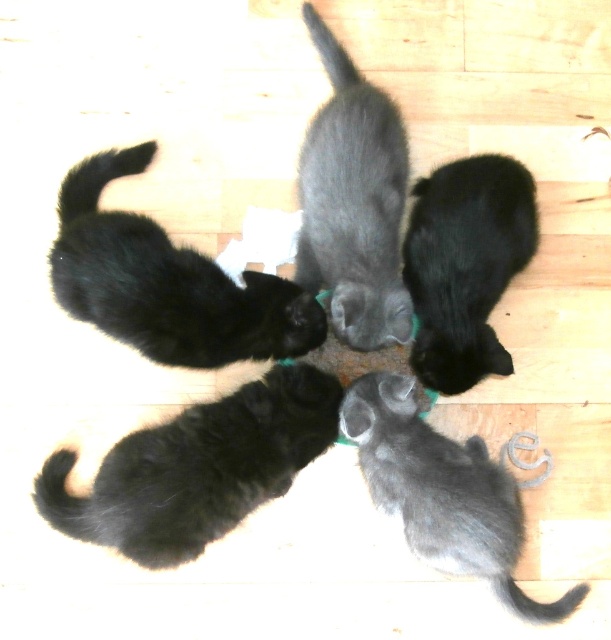
Question: Can you confirm if black soft fur cat at upper left is positioned to the left of gray fluffy kitten at center?

Choices:
 (A) no
 (B) yes

Answer: (B)

Question: Is black soft fur cat at upper left smaller than gray fluffy kitten at center?

Choices:
 (A) no
 (B) yes

Answer: (B)

Question: Can you confirm if black soft fur cat at upper left is thinner than black soft fur kitten at center?

Choices:
 (A) no
 (B) yes

Answer: (A)

Question: Which point is farther to the camera?

Choices:
 (A) black fluffy cat at lower left
 (B) gray fluffy cat at center

Answer: (B)

Question: Which of these objects is positioned closest to the black soft fur cat at upper left?

Choices:
 (A) black fluffy cat at lower left
 (B) gray fluffy cat at center

Answer: (B)

Question: Among these objects, which one is nearest to the camera?

Choices:
 (A) black fluffy cat at lower left
 (B) black soft fur kitten at center
 (C) gray fluffy cat at center

Answer: (A)